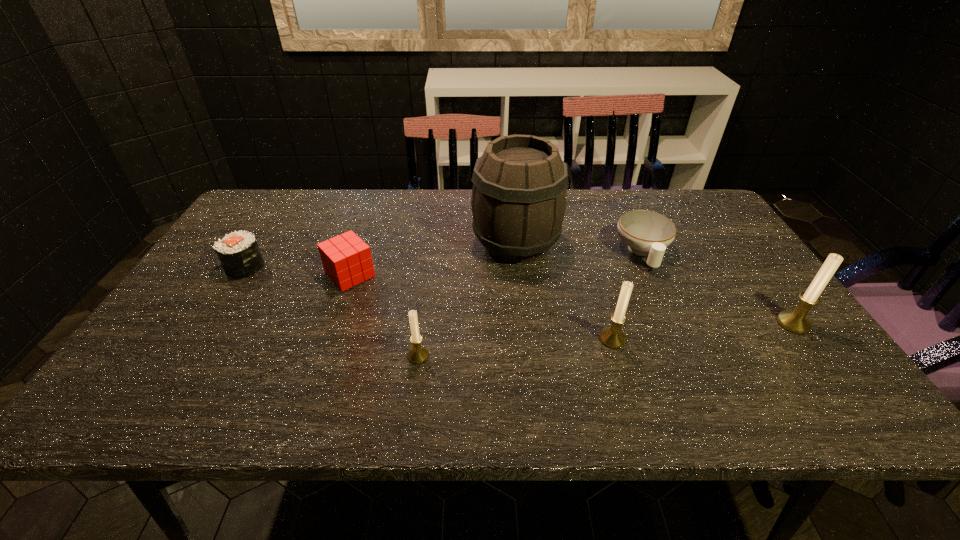
At what (x,y) coordinates should I click in order to perform the action: click on the fourth shortest object. Please return your answer as a coordinate pair (x, y). Looking at the image, I should click on (418, 354).

Where is `the shortest candle holder`? The width and height of the screenshot is (960, 540). the shortest candle holder is located at coordinates (418, 354).

Find the location of a particular element. The width and height of the screenshot is (960, 540). the second shortest candle holder is located at coordinates [612, 337].

This screenshot has height=540, width=960. In order to click on the fifth object from left to right in this screenshot , I will do `click(612, 337)`.

Where is `the rightmost candle holder`? The image size is (960, 540). the rightmost candle holder is located at coordinates (795, 321).

Where is `the tallest candle holder`? The height and width of the screenshot is (540, 960). the tallest candle holder is located at coordinates (795, 321).

The height and width of the screenshot is (540, 960). I want to click on wine bucket, so click(518, 202).

What are the coordinates of `the fourth object from left to right` in the screenshot? It's located at (518, 202).

You are a GUI agent. You are given a task and a screenshot of the screen. Output one action in this format:
    pyautogui.click(x=<x>, y=<y>)
    Task: Click on the sixth object from left to right
    The height and width of the screenshot is (540, 960).
    Given the screenshot: What is the action you would take?
    pyautogui.click(x=647, y=233)

Find the location of `sushi`. sushi is located at coordinates point(238,252).